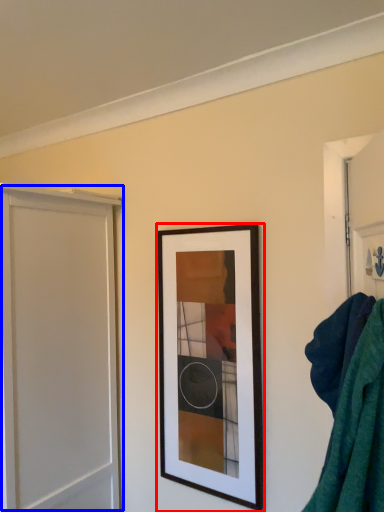
Question: Among these objects, which one is farthest to the camera, picture frame (highlighted by a red box) or screen door (highlighted by a blue box)?

Choices:
 (A) picture frame
 (B) screen door

Answer: (A)